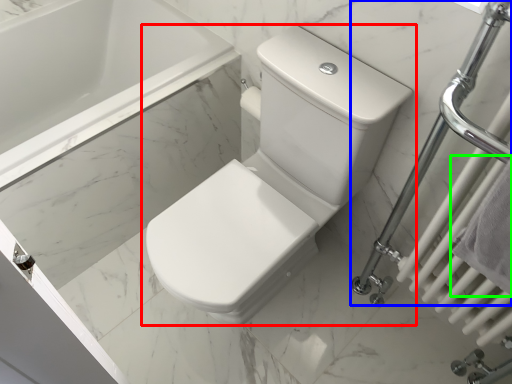
Question: Which object is the farthest from toilet (highlighted by a red box)? Choose among these: shower (highlighted by a blue box) or bath towel (highlighted by a green box).

Choices:
 (A) shower
 (B) bath towel

Answer: (B)